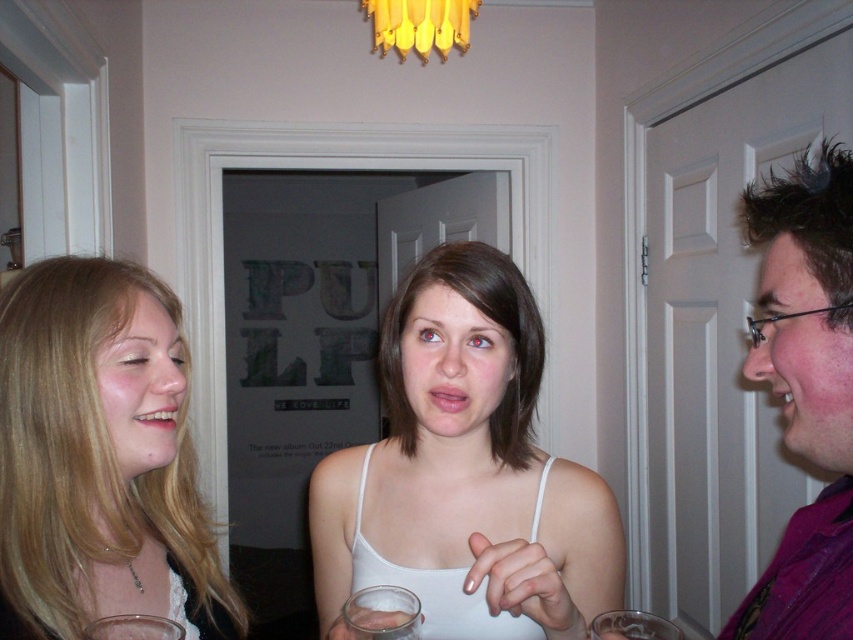
Question: Can you confirm if blonde hair at left is bigger than transparent glass at center?

Choices:
 (A) yes
 (B) no

Answer: (A)

Question: Which point is closer to the camera?

Choices:
 (A) clear glass wine glass at lower left
 (B) white fabric tank top at center
 (C) blonde hair at left

Answer: (A)

Question: Which point appears farthest from the camera in this image?

Choices:
 (A) (334, 476)
 (B) (828, 445)
 (C) (142, 621)

Answer: (A)

Question: Can you confirm if clear glass at lower center is positioned to the left of clear glass wine glass at lower left?

Choices:
 (A) yes
 (B) no

Answer: (B)

Question: Is white fabric tank top at center further to camera compared to transparent glass at center?

Choices:
 (A) no
 (B) yes

Answer: (B)

Question: Which of the following is the closest to the observer?

Choices:
 (A) transparent glass at center
 (B) clear glass wine glass at lower left

Answer: (B)